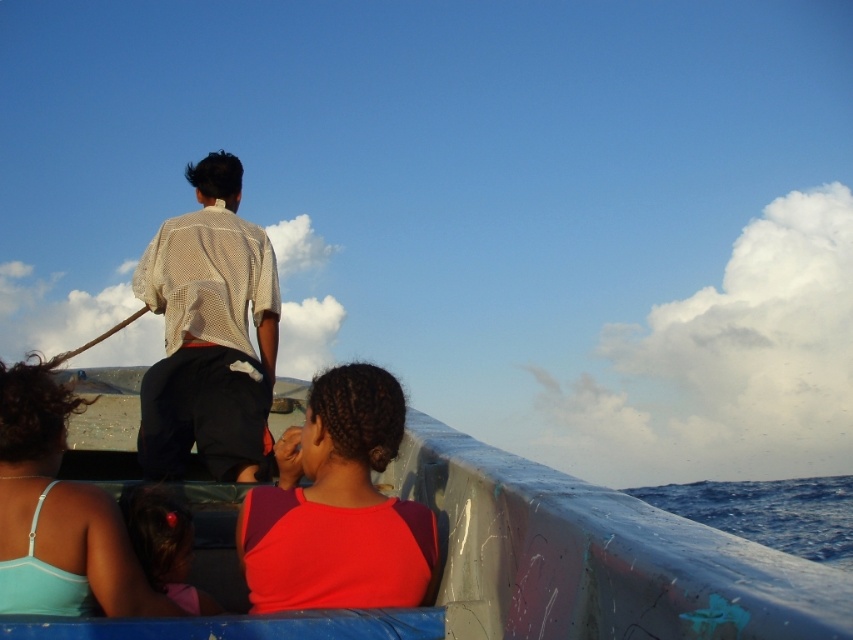
Who is shorter, blue painted wood boat at center or light beige mesh shirt at upper left?

blue painted wood boat at center

What do you see at coordinates (537, 566) in the screenshot? The width and height of the screenshot is (853, 640). I see `blue painted wood boat at center` at bounding box center [537, 566].

Image resolution: width=853 pixels, height=640 pixels. I want to click on blue painted wood boat at center, so click(537, 566).

Who is positioned more to the right, light beige mesh shirt at upper left or matte red shirt at center?

matte red shirt at center

Is light beige mesh shirt at upper left further to camera compared to matte red shirt at center?

Yes, it is behind matte red shirt at center.

The image size is (853, 640). Describe the element at coordinates (209, 333) in the screenshot. I see `light beige mesh shirt at upper left` at that location.

Locate an element on the screen. The height and width of the screenshot is (640, 853). light beige mesh shirt at upper left is located at coordinates (209, 333).

Consider the image. Can you confirm if blue painted wood boat at center is bigger than light blue fabric top at lower left?

Correct, blue painted wood boat at center is larger in size than light blue fabric top at lower left.

Consider the image. Who is more forward, (834, 621) or (28, 582)?

Point (834, 621) is more forward.

Where is `blue painted wood boat at center`? blue painted wood boat at center is located at coordinates tap(537, 566).